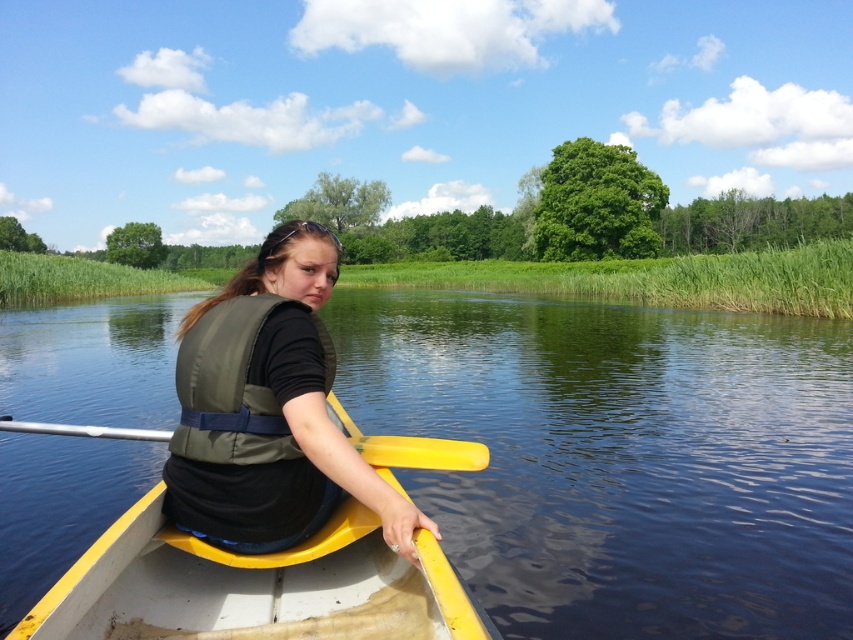
You are planning to store the yellow plastic boat at center and the olive green life vest at center in a storage container. The container can only hold items up to the size of the smaller object. Which item will not fit?

The olive green life vest at center will not fit in the storage container because the yellow plastic boat at center is smaller than the olive green life vest at center, and the container can only accommodate items up to the size of the smaller object.

You are standing at the edge of the water and want to reach a specific point marked at coordinates point (207, 628). The canoe is currently 3 meters away from you. Can you use the canoe to reach that point?

The distance of point (207, 628) from viewer is 2.72 meters, which is closer than the canoe being 3 meters away. Therefore, you cannot reach the point using the canoe since it is farther away than the target point.

You are in a canoe and want to check the water quality. You dip the yellow plastic paddle at center into the clear water at center. According to the scene description, is the paddle fully submerged in the water?

The clear water at center is located above the yellow plastic paddle at center, meaning the paddle is submerged in the water up to the water level. However, the description does not specify the depth of the water or the paddle length, so it is unclear if the paddle is fully submerged.